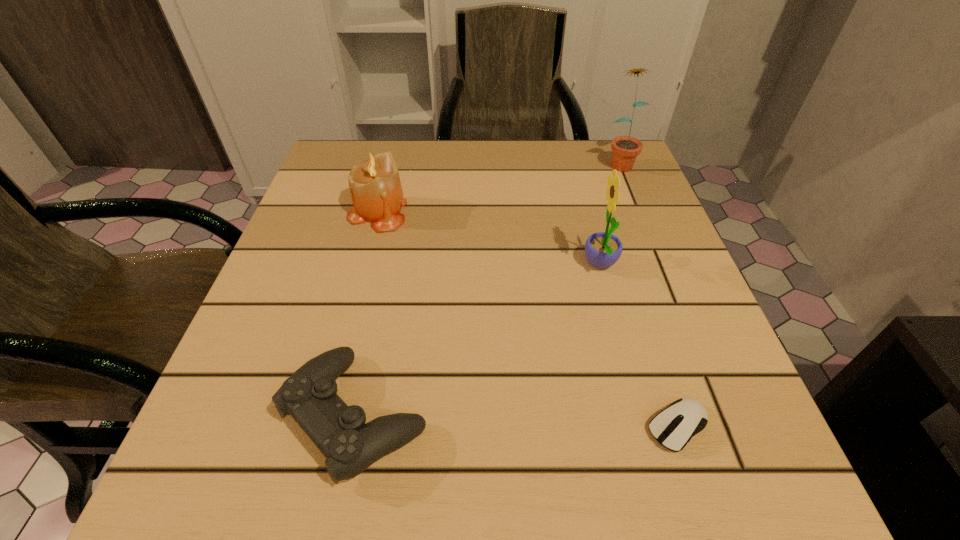
In order to click on the right sunflower in this screenshot , I will do `click(625, 149)`.

Locate an element on the screen. The width and height of the screenshot is (960, 540). the farther sunflower is located at coordinates point(625,149).

Locate an element on the screen. The width and height of the screenshot is (960, 540). the left sunflower is located at coordinates (602, 249).

Image resolution: width=960 pixels, height=540 pixels. I want to click on the nearer sunflower, so click(602, 249).

Locate an element on the screen. This screenshot has width=960, height=540. candle is located at coordinates (375, 187).

Locate an element on the screen. the fourth nearest object is located at coordinates (375, 187).

Find the location of `the fourth tallest object`. the fourth tallest object is located at coordinates (309, 395).

The width and height of the screenshot is (960, 540). What are the coordinates of `mouse` in the screenshot? It's located at 673,427.

You are a GUI agent. You are given a task and a screenshot of the screen. Output one action in this format:
    pyautogui.click(x=<x>, y=<y>)
    Task: Click on the vacant region located on the flower of the right sunflower
    
    Given the screenshot: What is the action you would take?
    [x=651, y=240]

Where is `free space located on the front-facing side of the left sunflower`? The width and height of the screenshot is (960, 540). free space located on the front-facing side of the left sunflower is located at coordinates click(402, 265).